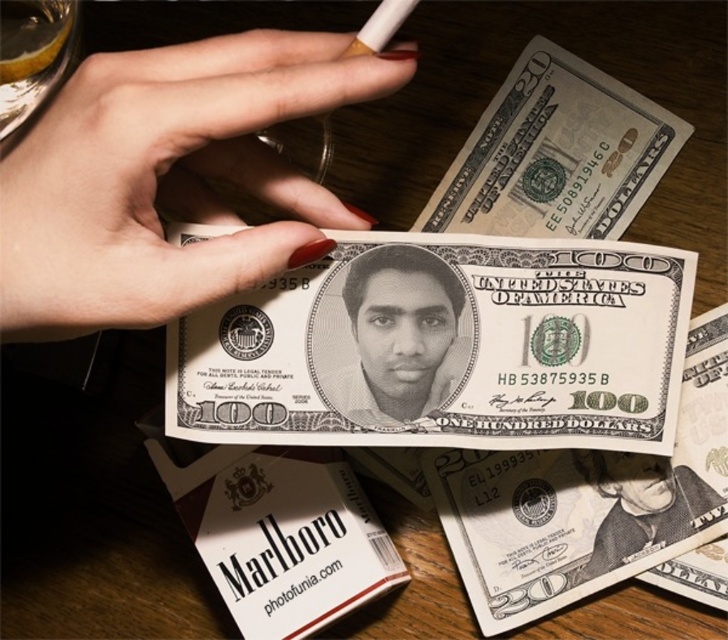
Does point (505, 285) come behind point (75, 237)?

That is True.

Is point (513, 358) farther from viewer compared to point (290, 179)?

Yes, it is behind point (290, 179).

The height and width of the screenshot is (640, 728). I want to click on white paper currency at center, so click(443, 348).

Between white paper currency at center and black matte portrait at center, which one has more height?

Standing taller between the two is white paper currency at center.

Who is positioned more to the right, white paper currency at center or black matte portrait at center?

Positioned to the right is white paper currency at center.

Locate an element on the screen. This screenshot has width=728, height=640. white paper currency at center is located at coordinates (443, 348).

Can you confirm if nail polish at center is wider than smooth paper money at center?

Indeed, nail polish at center has a greater width compared to smooth paper money at center.

Which is behind, point (134, 177) or point (644, 531)?

Positioned behind is point (644, 531).

Is point (234, 100) positioned after point (596, 472)?

No, (234, 100) is closer to viewer.

Identify the location of nail polish at center. (170, 179).